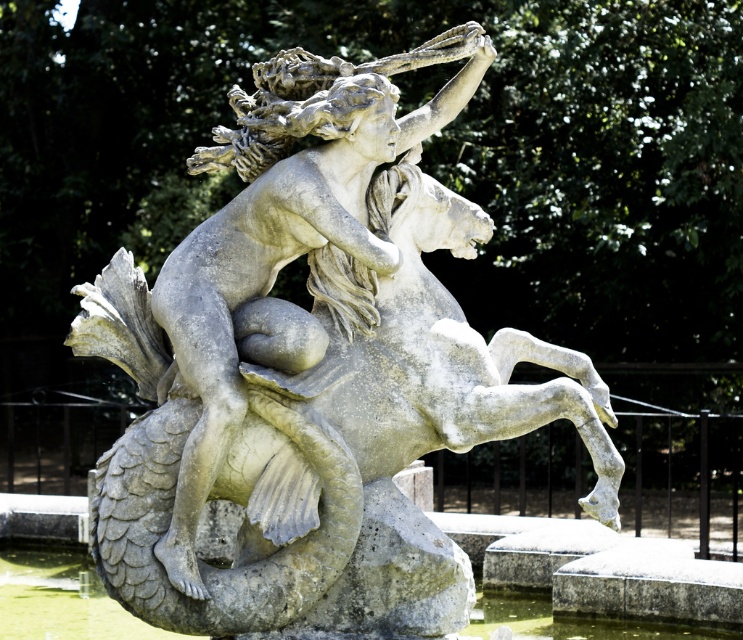
Question: Is gray stone sculpture at center in front of greenish stone water at lower center?

Choices:
 (A) yes
 (B) no

Answer: (B)

Question: Can you confirm if gray stone sculpture at center is thinner than greenish stone water at lower center?

Choices:
 (A) yes
 (B) no

Answer: (A)

Question: Which object is closer to the camera taking this photo?

Choices:
 (A) greenish stone water at lower center
 (B) gray stone sculpture at center

Answer: (A)

Question: Where is gray stone sculpture at center located in relation to greenish stone water at lower center in the image?

Choices:
 (A) right
 (B) left

Answer: (A)

Question: Which point is farther to the camera?

Choices:
 (A) greenish stone water at lower center
 (B) gray stone sculpture at center

Answer: (B)

Question: Which object is farther from the camera taking this photo?

Choices:
 (A) greenish stone water at lower center
 (B) gray stone sculpture at center

Answer: (B)